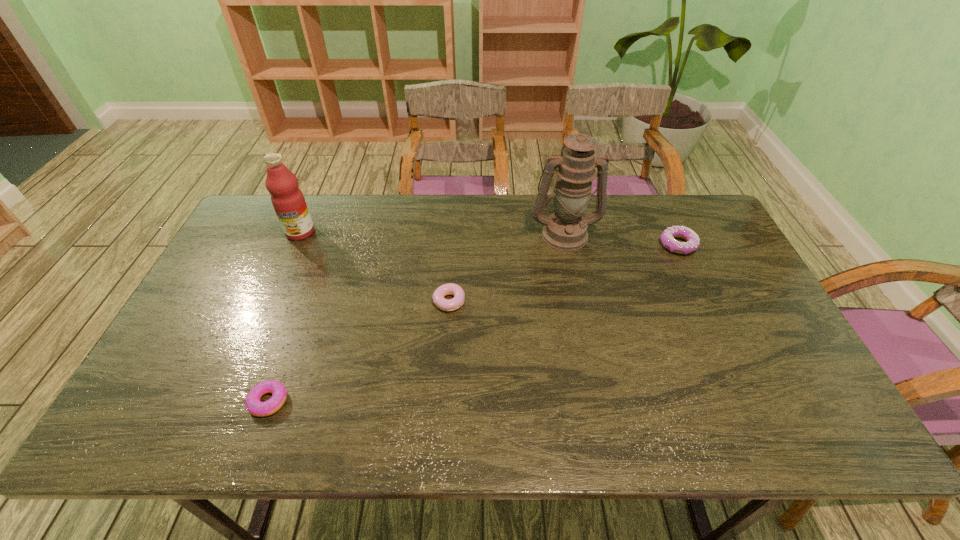
This screenshot has height=540, width=960. Find the location of `object situated at the right edge`. object situated at the right edge is located at coordinates (692, 243).

What are the coordinates of `object positioned at the far left corner` in the screenshot? It's located at (288, 201).

Where is `object that is at the far right corner`? The width and height of the screenshot is (960, 540). object that is at the far right corner is located at coordinates (692, 243).

The image size is (960, 540). In order to click on vacant space at the far edge of the desktop in this screenshot , I will do `click(510, 227)`.

The image size is (960, 540). I want to click on blank space at the near edge, so click(x=488, y=441).

I want to click on free space at the left edge, so click(x=182, y=328).

You are a GUI agent. You are given a task and a screenshot of the screen. Output one action in this format:
    pyautogui.click(x=<x>, y=<y>)
    Task: Click on the free space at the right edge of the desktop
    
    Given the screenshot: What is the action you would take?
    pyautogui.click(x=728, y=332)

Find the location of `empty space that is in between the fourth shortest object and the nearest object`. empty space that is in between the fourth shortest object and the nearest object is located at coordinates (284, 317).

Find the location of a particular element. Image resolution: width=960 pixels, height=540 pixels. vacant area between the second farthest doughnut and the third shortest object is located at coordinates (564, 273).

Locate an element on the screen. Image resolution: width=960 pixels, height=540 pixels. vacant space that's between the nearest doughnut and the second tallest doughnut is located at coordinates (359, 352).